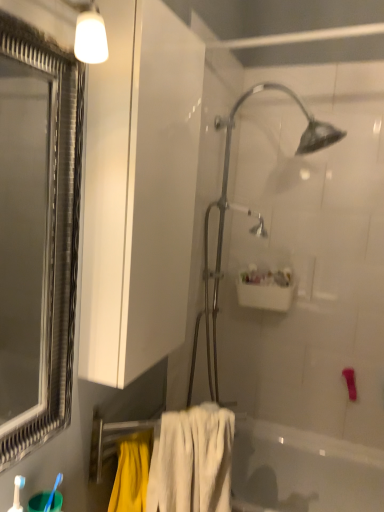
Question: Considering the relative positions of white glossy bathtub at lower center and white glossy sink at upper center in the image provided, is white glossy bathtub at lower center in front of white glossy sink at upper center?

Choices:
 (A) yes
 (B) no

Answer: (A)

Question: Does white glossy bathtub at lower center have a lesser height compared to white glossy sink at upper center?

Choices:
 (A) yes
 (B) no

Answer: (B)

Question: Does white glossy bathtub at lower center turn towards white glossy sink at upper center?

Choices:
 (A) no
 (B) yes

Answer: (A)

Question: Considering the relative sizes of white glossy bathtub at lower center and white glossy sink at upper center in the image provided, is white glossy bathtub at lower center taller than white glossy sink at upper center?

Choices:
 (A) no
 (B) yes

Answer: (B)

Question: From a real-world perspective, is white glossy bathtub at lower center beneath white glossy sink at upper center?

Choices:
 (A) yes
 (B) no

Answer: (A)

Question: From a real-world perspective, is white glossy bathtub at lower center over white glossy sink at upper center?

Choices:
 (A) yes
 (B) no

Answer: (B)

Question: Is blue plastic toothbrush at lower left further to camera compared to white glossy sink at upper center?

Choices:
 (A) yes
 (B) no

Answer: (B)

Question: Does blue plastic toothbrush at lower left appear on the right side of white glossy sink at upper center?

Choices:
 (A) yes
 (B) no

Answer: (B)

Question: Is blue plastic toothbrush at lower left shorter than white glossy sink at upper center?

Choices:
 (A) yes
 (B) no

Answer: (A)

Question: Is blue plastic toothbrush at lower left facing towards white glossy sink at upper center?

Choices:
 (A) no
 (B) yes

Answer: (A)

Question: Is blue plastic toothbrush at lower left facing away from white glossy sink at upper center?

Choices:
 (A) no
 (B) yes

Answer: (A)

Question: From a real-world perspective, is blue plastic toothbrush at lower left on top of white glossy sink at upper center?

Choices:
 (A) no
 (B) yes

Answer: (A)

Question: From the image's perspective, is white soft towel at lower center located beneath blue plastic toothbrush at lower left?

Choices:
 (A) yes
 (B) no

Answer: (A)